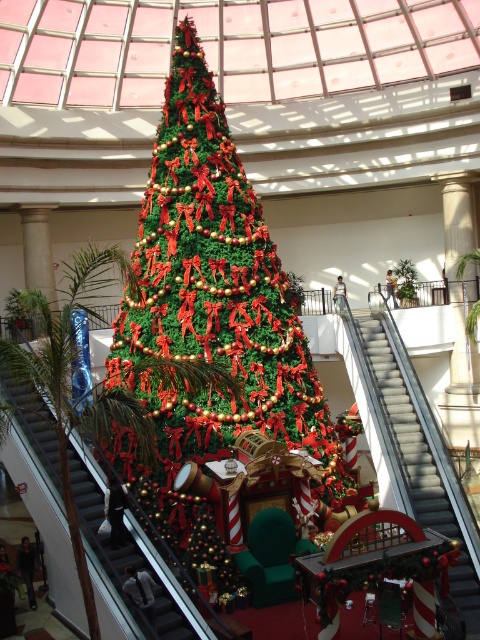
Question: Is green artificial christmas tree at center bigger than metallic silver escalator at left?

Choices:
 (A) yes
 (B) no

Answer: (A)

Question: Is green artificial christmas tree at center positioned at the back of metallic gray escalator at center?

Choices:
 (A) no
 (B) yes

Answer: (B)

Question: Among these objects, which one is farthest from the camera?

Choices:
 (A) green artificial christmas tree at center
 (B) metallic gray escalator at center
 (C) metallic silver escalator at left

Answer: (A)

Question: Which object appears farthest from the camera in this image?

Choices:
 (A) metallic gray escalator at center
 (B) green artificial christmas tree at center
 (C) metallic silver escalator at left

Answer: (B)

Question: Can you confirm if metallic gray escalator at center is positioned to the left of metallic silver escalator at left?

Choices:
 (A) yes
 (B) no

Answer: (B)

Question: Which object appears closest to the camera in this image?

Choices:
 (A) green artificial christmas tree at center
 (B) metallic gray escalator at center
 (C) metallic silver escalator at left

Answer: (C)